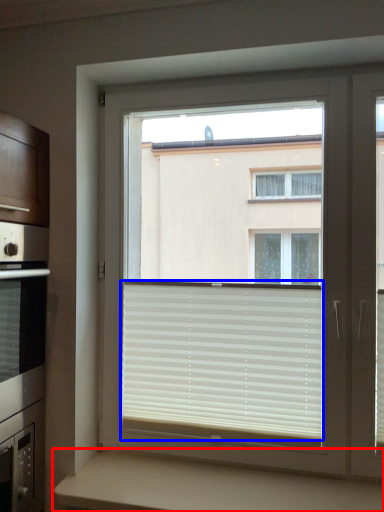
Question: Which object is closer to the camera taking this photo, counter (highlighted by a red box) or window blind (highlighted by a blue box)?

Choices:
 (A) counter
 (B) window blind

Answer: (A)